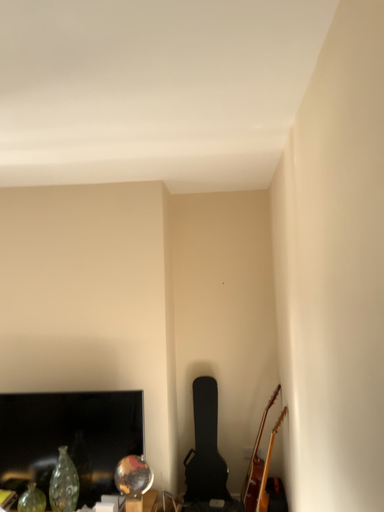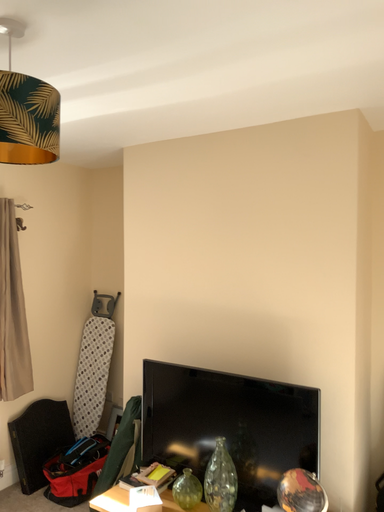
Question: Which way did the camera rotate in the video?

Choices:
 (A) rotated right
 (B) rotated left

Answer: (B)